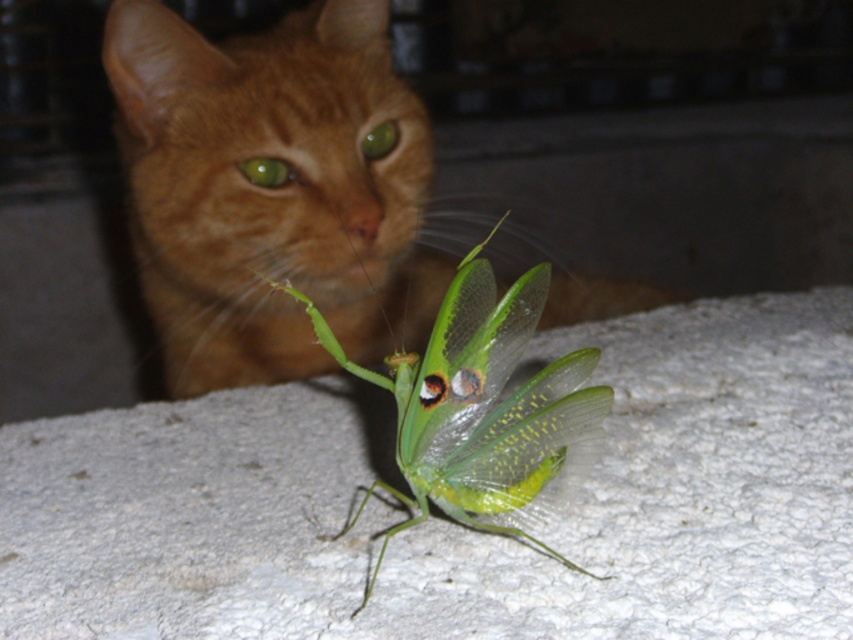
Consider the image. Is orange fur cat at upper center smaller than green translucent mantis at center?

No, orange fur cat at upper center is not smaller than green translucent mantis at center.

Describe the element at coordinates (271, 189) in the screenshot. Image resolution: width=853 pixels, height=640 pixels. I see `orange fur cat at upper center` at that location.

Where is `orange fur cat at upper center`? This screenshot has height=640, width=853. orange fur cat at upper center is located at coordinates (271, 189).